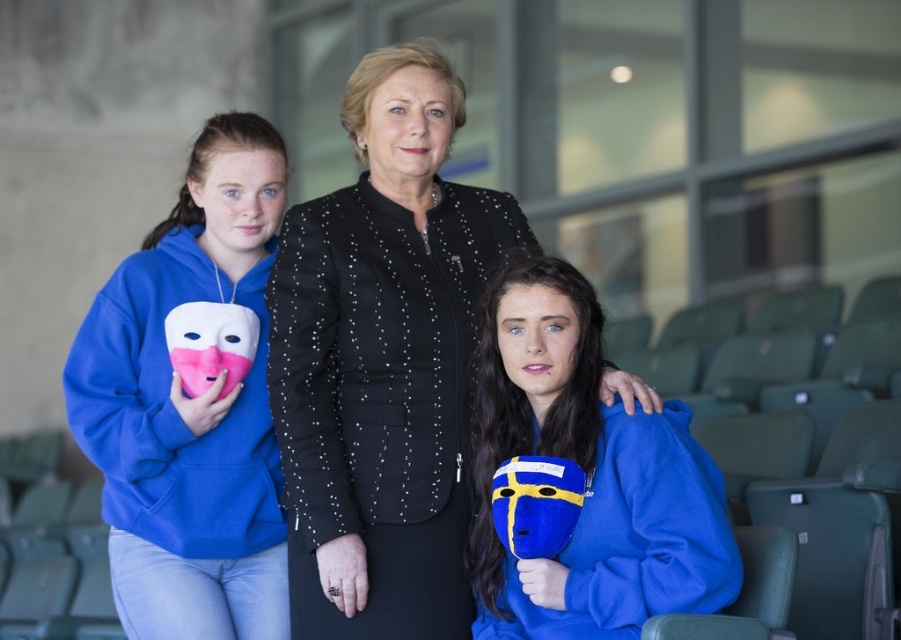
You are a photographer setting up a camera to capture the scene. You need to ensure that both the black textured jacket at center and the blue matte mask at center are fully visible in the frame. Given their sizes, which object requires a wider angle to accommodate its width?

The black textured jacket at center requires a wider angle because its width surpasses that of the blue matte mask at center.

You are standing in the indoor sports arena and see two points marked on the floor at coordinates point (392,541) and point (579,458). If you need to walk towards the point that is further away from the entrance, which coordinate should you head to?

Point (392,541) is behind point (579,458), so you should head to point (392,541) as it is further away from the entrance.